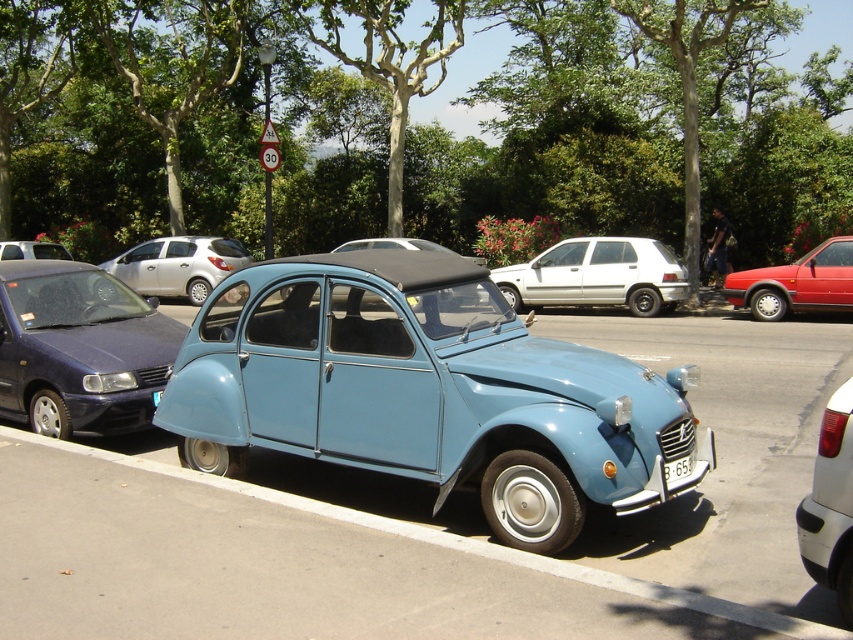
Question: Which point is farther to the camera?

Choices:
 (A) (22, 346)
 (B) (143, 257)

Answer: (B)

Question: Considering the real-world distances, which object is closest to the matte black car at left?

Choices:
 (A) silver metallic hatchback at center
 (B) matte blue car at center

Answer: (A)

Question: Is metallic blue car at center to the right of light blue matte car at center from the viewer's perspective?

Choices:
 (A) no
 (B) yes

Answer: (B)

Question: Can you confirm if white matte hatchback at center is positioned below white glossy tail light at lower right?

Choices:
 (A) yes
 (B) no

Answer: (B)

Question: Estimate the real-world distances between objects in this image. Which object is closer to the metallic blue car at center?

Choices:
 (A) silver metallic hatchback at center
 (B) white plastic license plate at lower center
 (C) light blue matte car at center
 (D) matte black car at left

Answer: (B)

Question: Observing the image, what is the correct spatial positioning of light blue matte car at center in reference to matte black car at left?

Choices:
 (A) right
 (B) left

Answer: (A)